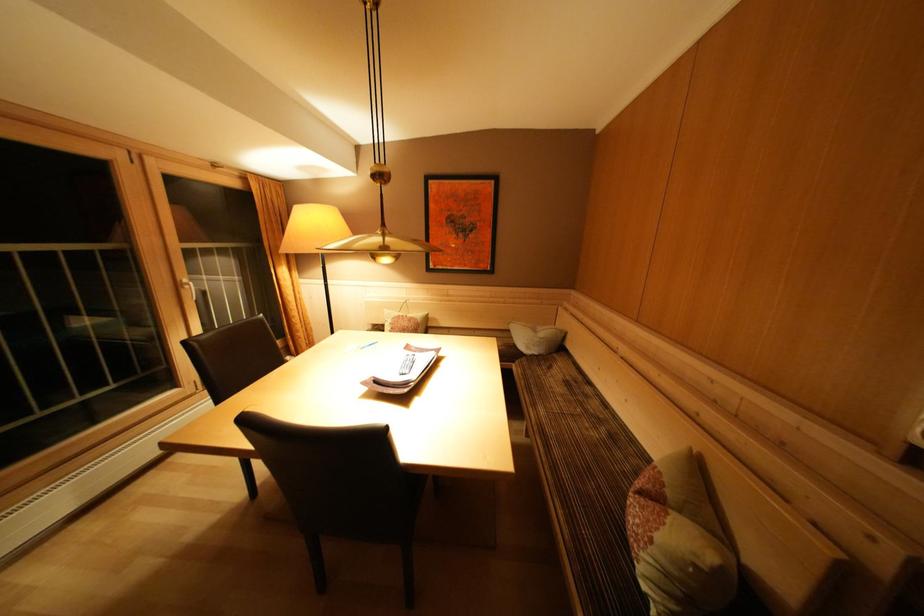
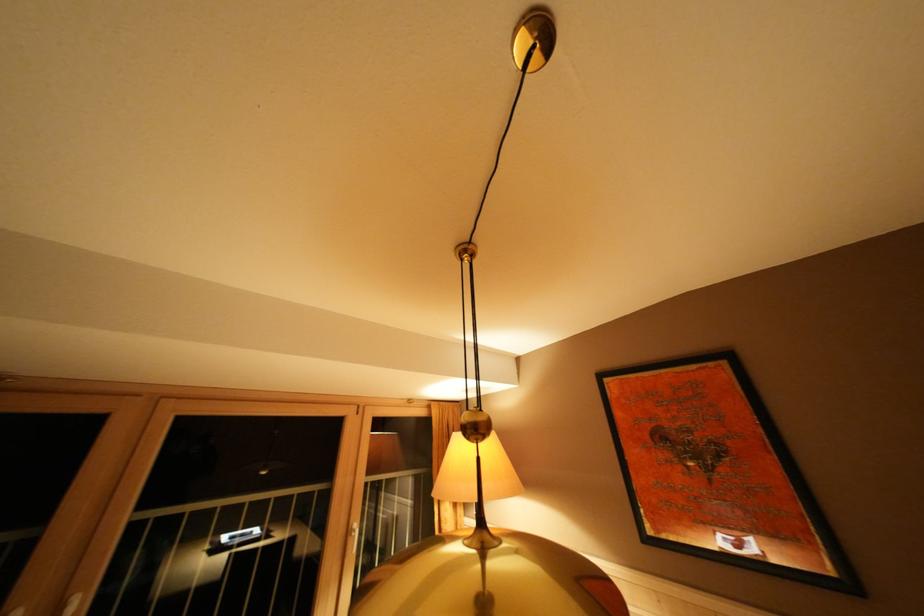
In the second image, find the point that corresponds to (x=185, y=292) in the first image.

(355, 537)